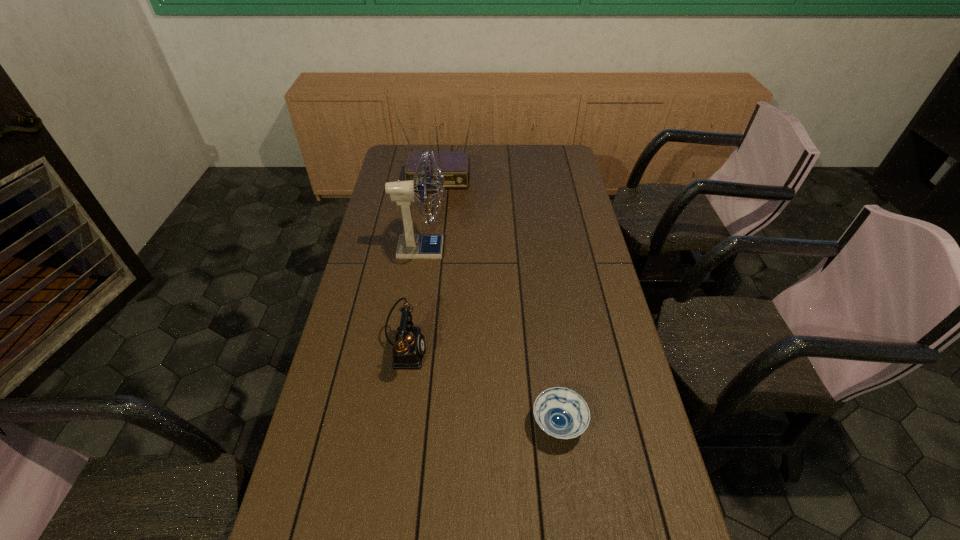
In the image, there is a desktop. What are the coordinates of `vacant space at the right edge` in the screenshot? It's located at (574, 369).

Where is `vacant space at the far right corner of the desktop`? The image size is (960, 540). vacant space at the far right corner of the desktop is located at coordinates (568, 148).

In order to click on blank region between the nearest object and the radio_receiver in this screenshot , I will do point(498,297).

Where is `free space between the soup bowl and the farthest object`? The height and width of the screenshot is (540, 960). free space between the soup bowl and the farthest object is located at coordinates (498, 297).

Locate an element on the screen. free spot between the second nearest object and the third shortest object is located at coordinates (421, 260).

Locate an element on the screen. The width and height of the screenshot is (960, 540). vacant space that is in between the tallest object and the farthest object is located at coordinates point(430,210).

Identify the location of free space between the tallest object and the second tallest object. This screenshot has height=540, width=960. (430, 210).

At what (x,y) coordinates should I click in order to perform the action: click on vacant area that lies between the third tallest object and the tallest object. Please return your answer as a coordinate pair (x, y). The width and height of the screenshot is (960, 540). Looking at the image, I should click on (414, 300).

I want to click on vacant space that's between the telephone and the radio_receiver, so click(421, 260).

Find the location of a particular element. Image resolution: width=960 pixels, height=540 pixels. object identified as the closest to the fan is located at coordinates (408, 351).